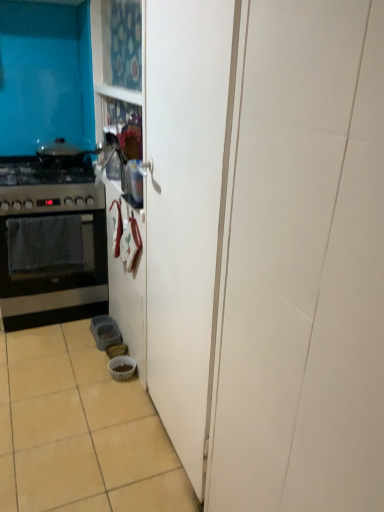
Question: Are white glossy bowl at lower center and beige ceramic tile at lower left making contact?

Choices:
 (A) no
 (B) yes

Answer: (A)

Question: Considering the relative positions of white glossy bowl at lower center and beige ceramic tile at lower left in the image provided, is white glossy bowl at lower center to the right of beige ceramic tile at lower left from the viewer's perspective?

Choices:
 (A) no
 (B) yes

Answer: (B)

Question: From a real-world perspective, is white glossy bowl at lower center on top of beige ceramic tile at lower left?

Choices:
 (A) no
 (B) yes

Answer: (B)

Question: Is white glossy bowl at lower center wider than beige ceramic tile at lower left?

Choices:
 (A) no
 (B) yes

Answer: (A)

Question: Does white glossy bowl at lower center contain beige ceramic tile at lower left?

Choices:
 (A) yes
 (B) no

Answer: (B)

Question: Is point (38, 220) closer or farther from the camera than point (64, 194)?

Choices:
 (A) farther
 (B) closer

Answer: (B)

Question: Looking at the image, does black matte oven at left seem bigger or smaller compared to black matte gas stove at left?

Choices:
 (A) small
 (B) big

Answer: (A)

Question: In the image, is black matte oven at left on the left side or the right side of black matte gas stove at left?

Choices:
 (A) right
 (B) left

Answer: (A)

Question: In terms of width, does black matte oven at left look wider or thinner when compared to black matte gas stove at left?

Choices:
 (A) wide
 (B) thin

Answer: (B)

Question: Which is correct: shiny silver pot at left is inside white glossy bowl at lower center, or outside of it?

Choices:
 (A) inside
 (B) outside

Answer: (B)

Question: From the image's perspective, is shiny silver pot at left located above or below white glossy bowl at lower center?

Choices:
 (A) below
 (B) above

Answer: (B)

Question: Considering the positions of shiny silver pot at left and white glossy bowl at lower center in the image, is shiny silver pot at left bigger or smaller than white glossy bowl at lower center?

Choices:
 (A) small
 (B) big

Answer: (B)

Question: Is point (69, 161) positioned closer to the camera than point (132, 361)?

Choices:
 (A) closer
 (B) farther

Answer: (B)

Question: Is beige ceramic tile at lower left to the left or to the right of white glossy bowl at lower center in the image?

Choices:
 (A) left
 (B) right

Answer: (A)

Question: Is beige ceramic tile at lower left wider or thinner than white glossy bowl at lower center?

Choices:
 (A) thin
 (B) wide

Answer: (B)